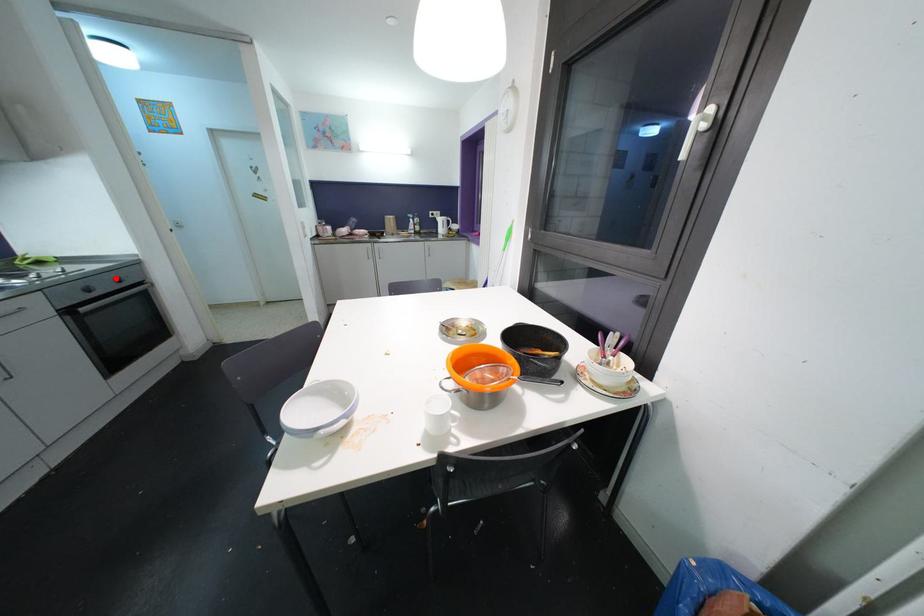
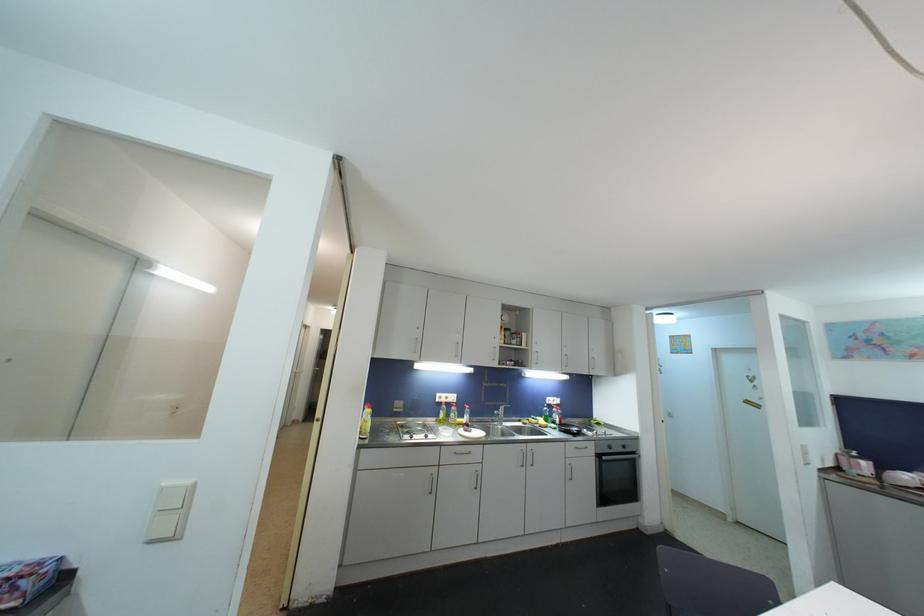
In the second image, find the point that corresponds to the highlighted location in the first image.

(625, 445)